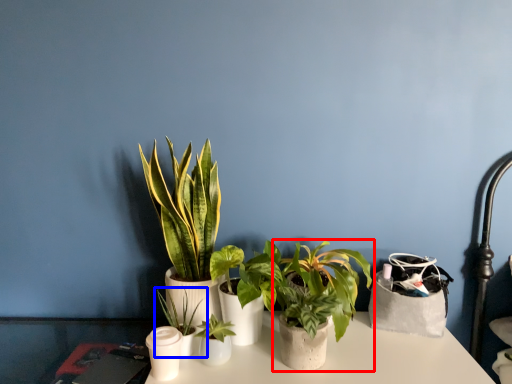
Question: Among these objects, which one is farthest to the camera, houseplant (highlighted by a red box) or houseplant (highlighted by a blue box)?

Choices:
 (A) houseplant
 (B) houseplant

Answer: (A)